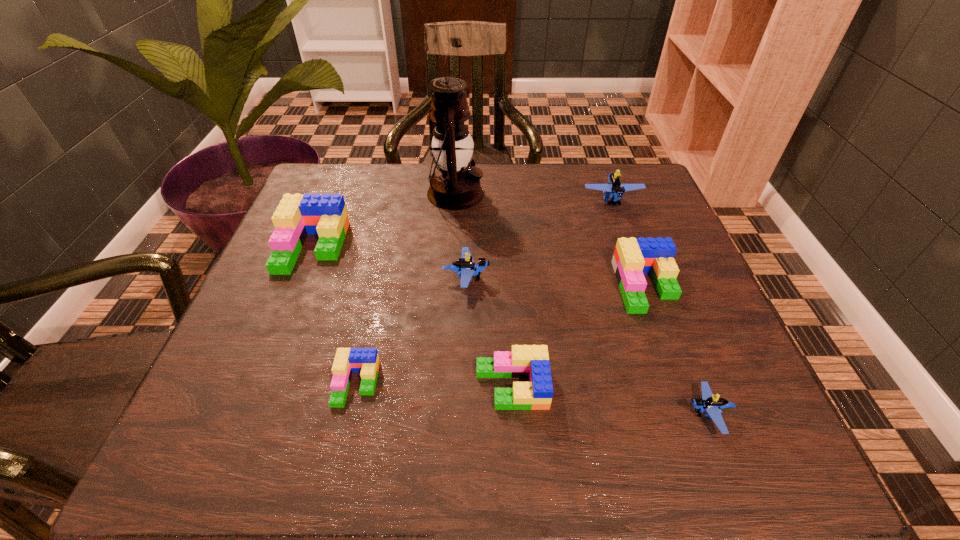
The image size is (960, 540). I want to click on vacant area located on the front-facing side of the smallest blue Lego, so click(x=612, y=414).

Where is `free space located 0.170m on the front-facing side of the smallest blue Lego`? This screenshot has width=960, height=540. free space located 0.170m on the front-facing side of the smallest blue Lego is located at coordinates (581, 414).

You are a GUI agent. You are given a task and a screenshot of the screen. Output one action in this format:
    pyautogui.click(x=<x>, y=<y>)
    Task: Click on the vacant space located on the front of the seventh object from right to left
    The height and width of the screenshot is (540, 960).
    Given the screenshot: What is the action you would take?
    pyautogui.click(x=339, y=462)

Find the location of a particular element. This screenshot has height=540, width=960. lantern that is at the far edge is located at coordinates (455, 185).

Locate an element on the screen. Lego located at the far edge is located at coordinates (614, 189).

Find the location of `object at the near edge`. object at the near edge is located at coordinates (712, 404).

Find the location of a particular element. object present at the left edge is located at coordinates (296, 216).

In order to click on object that is at the far right corner in this screenshot , I will do `click(614, 189)`.

Locate an element on the screen. The width and height of the screenshot is (960, 540). object that is positioned at the near right corner is located at coordinates (712, 404).

This screenshot has width=960, height=540. I want to click on vacant space at the far edge of the desktop, so click(416, 171).